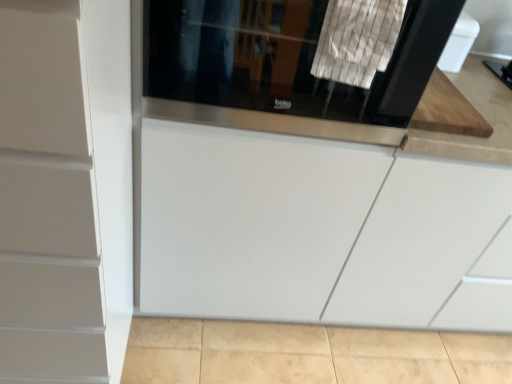
Question: Is white striped fabric at upper center wider or thinner than black glass screen door at upper center?

Choices:
 (A) thin
 (B) wide

Answer: (A)

Question: Based on their sizes in the image, would you say white striped fabric at upper center is bigger or smaller than black glass screen door at upper center?

Choices:
 (A) big
 (B) small

Answer: (B)

Question: Considering the real-world distances, which object is farthest from the white matte cabinet at left?

Choices:
 (A) white striped fabric at upper center
 (B) black glass screen door at upper center

Answer: (A)

Question: Estimate the real-world distances between objects in this image. Which object is farther from the white striped fabric at upper center?

Choices:
 (A) white matte cabinet at left
 (B) black glass screen door at upper center

Answer: (A)